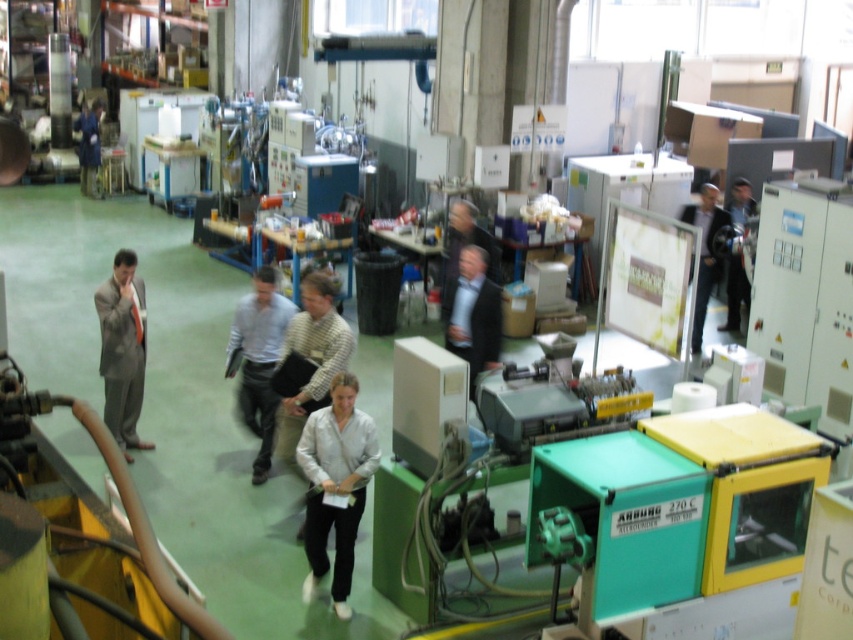
Can you confirm if matte gray suit at left is positioned above dark gray suit at center?

No.

Between point (128, 355) and point (694, 204), which one is positioned in front?

Point (128, 355) is in front.

Is point (106, 390) farther from viewer compared to point (712, 204)?

No, (106, 390) is closer to viewer.

Where is `matte gray suit at left`? The image size is (853, 640). matte gray suit at left is located at coordinates (122, 349).

Which is more to the left, light blue shirt at center or dark gray suit at center?

light blue shirt at center

Is light blue shirt at center positioned before dark gray suit at center?

Yes, light blue shirt at center is closer to the viewer.

Is point (289, 301) farther from viewer compared to point (695, 205)?

No, (289, 301) is closer to viewer.

This screenshot has width=853, height=640. I want to click on light blue shirt at center, so click(x=258, y=360).

Is matte gray suit at left positioned behind light blue shirt at center?

That is True.

Between point (103, 282) and point (258, 426), which one is positioned behind?

Positioned behind is point (103, 282).

The width and height of the screenshot is (853, 640). Identify the location of matte gray suit at left. [122, 349].